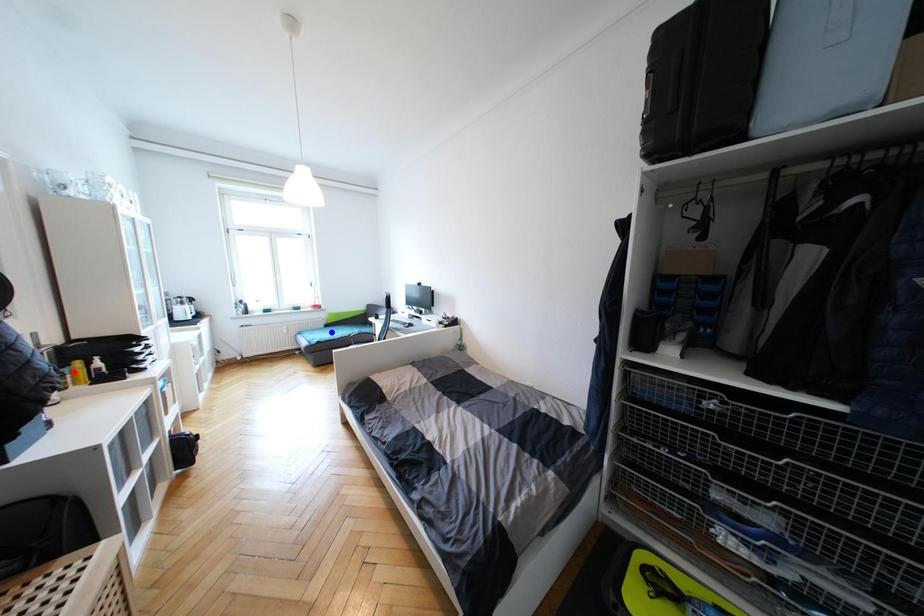
Question: Which of the two points in the image is closer to the camera?

Choices:
 (A) Blue point is closer.
 (B) Red point is closer.

Answer: (B)